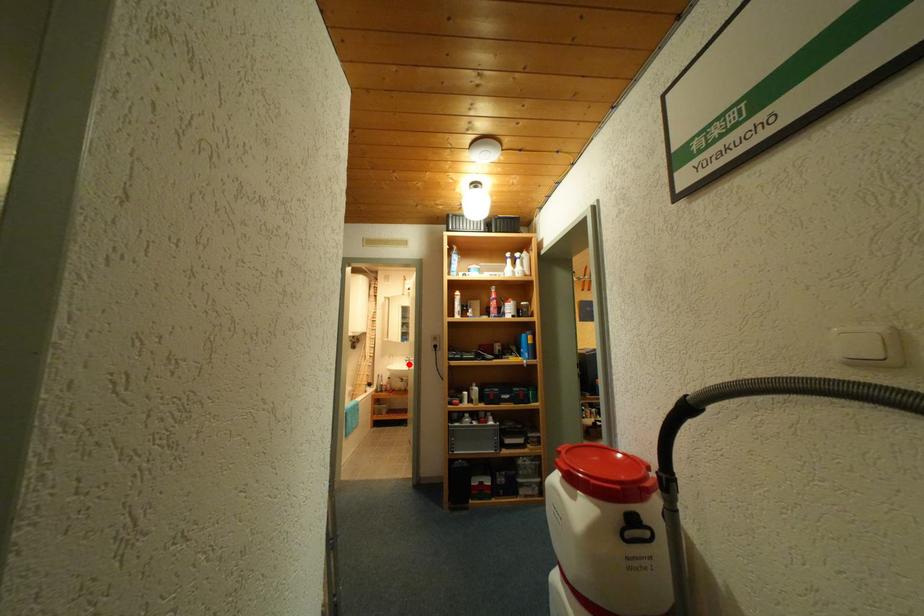
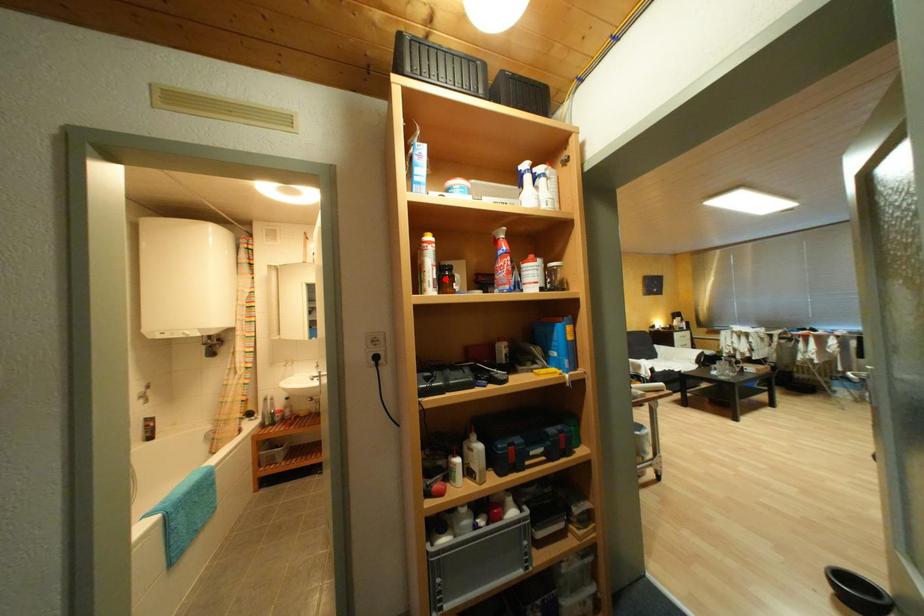
I am providing you with two images of the same scene from different viewpoints. A red point is marked on the first image and another point is marked on the second image. Does the point marked in image1 correspond to the same location as the one in image2?

No